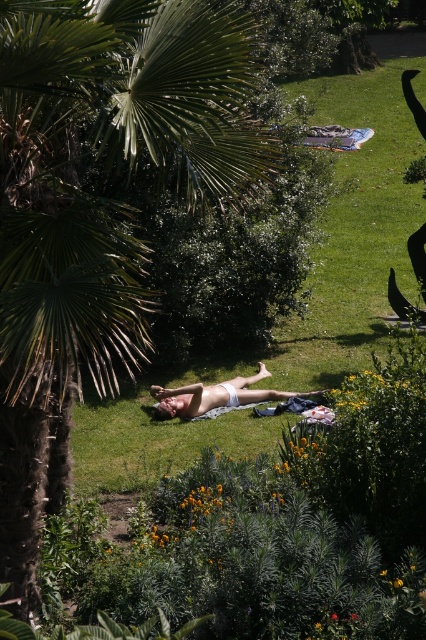
The image size is (426, 640). What are the coordinates of `green leafy palm tree at left` in the screenshot? It's located at (97, 208).

Can you confirm if green leafy palm tree at left is positioned below white fabric body at center?

No.

Is point (141, 12) positioned after point (264, 365)?

No, it is in front of (264, 365).

Locate an element on the screen. green leafy palm tree at left is located at coordinates (97, 208).

Is green leafy palm tree at left bigger than green grass at center?

No, green leafy palm tree at left is not bigger than green grass at center.

Between green leafy palm tree at left and green grass at center, which one is positioned lower?

green leafy palm tree at left

What do you see at coordinates (97, 208) in the screenshot? This screenshot has height=640, width=426. I see `green leafy palm tree at left` at bounding box center [97, 208].

Find the location of a particular element. The width and height of the screenshot is (426, 640). green leafy palm tree at left is located at coordinates (97, 208).

Is point (284, 346) farther from camera compared to point (270, 374)?

Yes.

Does green grass at center have a greater width compared to white fabric body at center?

Indeed, green grass at center has a greater width compared to white fabric body at center.

Is point (325, 88) closer to camera compared to point (264, 397)?

No.

Locate an element on the screen. Image resolution: width=426 pixels, height=640 pixels. green grass at center is located at coordinates (294, 314).